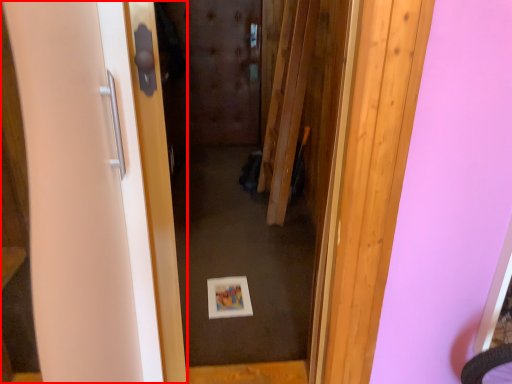
Question: From the image's perspective, considering the relative positions of door (annotated by the red box) and door in the image provided, where is door (annotated by the red box) located with respect to the staircase?

Choices:
 (A) below
 (B) above

Answer: (B)